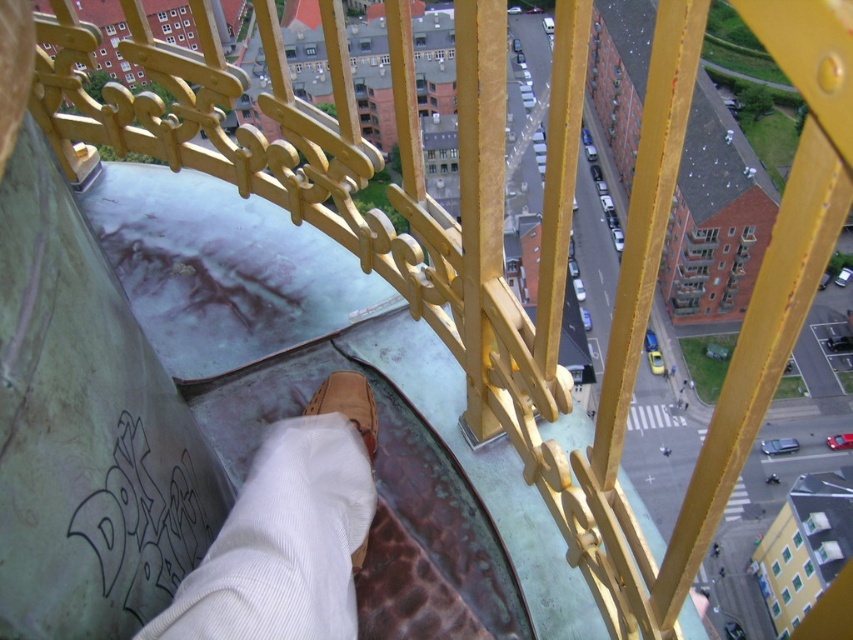
Is brown leather shoe at lower center in front of brown leather shoe at center?

Yes, it is.

Who is more forward, (302, 461) or (355, 412)?

Point (302, 461)

Locate an element on the screen. This screenshot has width=853, height=640. brown leather shoe at lower center is located at coordinates (289, 531).